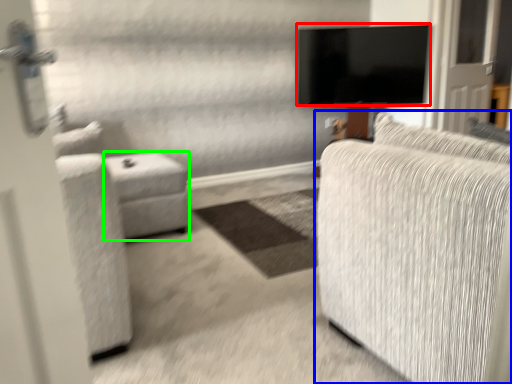
Question: Considering the real-world distances, which object is farthest from television (highlighted by a red box)? studio couch (highlighted by a blue box) or table (highlighted by a green box)?

Choices:
 (A) studio couch
 (B) table

Answer: (A)